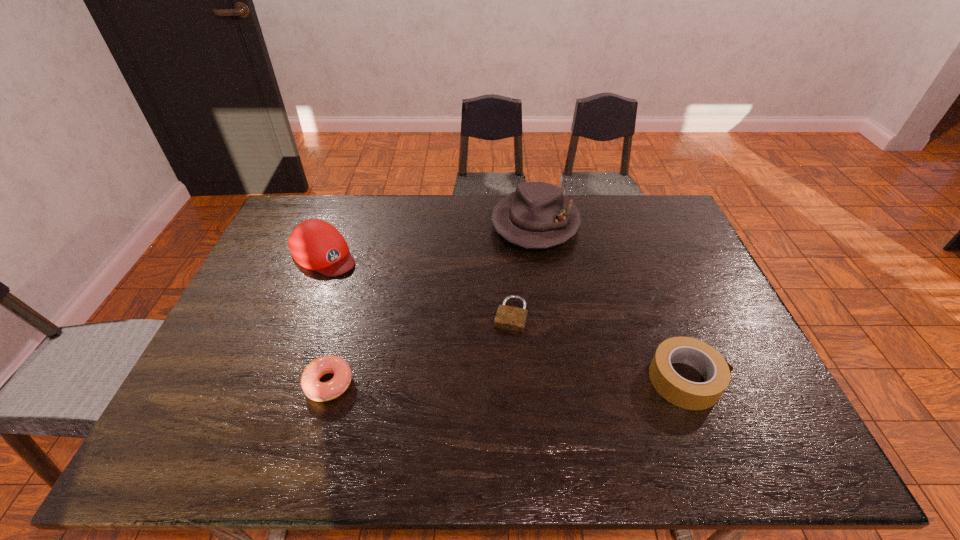
In order to click on object that ranks as the fourth closest to the third nearest object in this screenshot , I will do `click(315, 244)`.

This screenshot has width=960, height=540. What are the coordinates of `object that is the third nearest to the third nearest object` in the screenshot? It's located at (318, 391).

Identify the location of vacant area in the image that satisfies the following two spatial constraints: 1. on the back side of the fourth tallest object; 2. at the edge of the third shortest object. Image resolution: width=960 pixels, height=540 pixels. (330, 380).